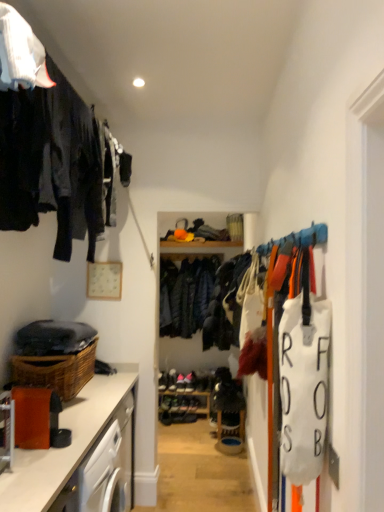
What is the approximate width of leather shoe at center, placed as the first shoe when sorted from bottom to top?

It is 7.48 inches.

The image size is (384, 512). In order to click on leather shoe at center, marked as the fourth shoe in a bottom-to-top arrangement in this screenshot , I will do `click(172, 379)`.

In terms of size, does leather shoe at center, the 3th shoe when ordered from bottom to top, appear bigger or smaller than dark blue woolen jacket at center?

Clearly, leather shoe at center, the 3th shoe when ordered from bottom to top, is smaller in size than dark blue woolen jacket at center.

Visually, is leather shoe at center, the 2th shoe viewed from the top, positioned to the left or to the right of dark blue woolen jacket at center?

In the image, leather shoe at center, the 2th shoe viewed from the top, appears on the left side of dark blue woolen jacket at center.

Consider the image. Can you confirm if leather shoe at center, the 3th shoe when ordered from bottom to top, is wider than dark blue woolen jacket at center?

Incorrect, the width of leather shoe at center, the 3th shoe when ordered from bottom to top, does not surpass that of dark blue woolen jacket at center.

What's the angular difference between wooden shelf at center and dark blue woolen jacket at center's facing directions?

The facing directions of wooden shelf at center and dark blue woolen jacket at center are 1.59 degrees apart.

Who is taller, wooden shelf at center or dark blue woolen jacket at center?

Standing taller between the two is dark blue woolen jacket at center.

Would you say dark blue woolen jacket at center is part of wooden shelf at center's contents?

Actually, dark blue woolen jacket at center is outside wooden shelf at center.

Which of these two, wooden shelf at center or dark blue woolen jacket at center, is wider?

dark blue woolen jacket at center.

Is leather shoe at center, arranged as the 4th shoe when viewed from the top, oriented towards matte brown countertop at lower left?

Yes, leather shoe at center, arranged as the 4th shoe when viewed from the top, is oriented towards matte brown countertop at lower left.

From a real-world perspective, does leather shoe at center, arranged as the 4th shoe when viewed from the top, stand above matte brown countertop at lower left?

Actually, leather shoe at center, arranged as the 4th shoe when viewed from the top, is physically below matte brown countertop at lower left in the real world.

From the image's perspective, which is below, leather shoe at center, placed as the first shoe when sorted from bottom to top, or matte brown countertop at lower left?

leather shoe at center, placed as the first shoe when sorted from bottom to top.

In the scene shown: Who is smaller, leather shoe at center, arranged as the 4th shoe when viewed from the top, or matte brown countertop at lower left?

leather shoe at center, arranged as the 4th shoe when viewed from the top.

From the image's perspective, is dark blue woolen jacket at center positioned above or below shiny black shoe at center, placed as the 3th shoe when sorted from top to bottom?

dark blue woolen jacket at center is above shiny black shoe at center, placed as the 3th shoe when sorted from top to bottom.

Considering the sizes of objects dark blue woolen jacket at center and shiny black shoe at center, placed as the 3th shoe when sorted from top to bottom, in the image provided, who is bigger, dark blue woolen jacket at center or shiny black shoe at center, placed as the 3th shoe when sorted from top to bottom,?

dark blue woolen jacket at center is bigger.

Is dark blue woolen jacket at center taller or shorter than shiny black shoe at center, placed as the 3th shoe when sorted from top to bottom?

In the image, dark blue woolen jacket at center appears to be taller than shiny black shoe at center, placed as the 3th shoe when sorted from top to bottom.

Which object is positioned more to the left, dark blue woolen jacket at center or shiny black shoe at center, placed as the 3th shoe when sorted from top to bottom?

shiny black shoe at center, placed as the 3th shoe when sorted from top to bottom, is more to the left.

Are matte black clothing at left and woven brown basket at lower left beside each other?

No, matte black clothing at left is not beside woven brown basket at lower left.

Is matte black clothing at left at the left side of woven brown basket at lower left?

No, matte black clothing at left is not to the left of woven brown basket at lower left.

Identify the location of basket behind the matte black clothing at left. [x=56, y=371].

Is matte black clothing at left bigger than woven brown basket at lower left?

Yes.

Considering the sizes of leather shoe at center, the 2th shoe viewed from the top, and woven brown basket at lower left in the image, is leather shoe at center, the 2th shoe viewed from the top, wider or thinner than woven brown basket at lower left?

Clearly, leather shoe at center, the 2th shoe viewed from the top, has less width compared to woven brown basket at lower left.

Which object is closer to the camera taking this photo, leather shoe at center, the 3th shoe when ordered from bottom to top, or woven brown basket at lower left?

Positioned in front is woven brown basket at lower left.

Based on the photo, is leather shoe at center, the 2th shoe viewed from the top, with woven brown basket at lower left?

They are not placed beside each other.

From a real-world perspective, is leather shoe at center, the 2th shoe viewed from the top, on top of woven brown basket at lower left?

Incorrect, from a real-world perspective, leather shoe at center, the 2th shoe viewed from the top, is lower than woven brown basket at lower left.

From a real-world perspective, relative to dark blue woolen jacket at center, is woven brown basket at lower left vertically above or below?

woven brown basket at lower left is below dark blue woolen jacket at center.

Does woven brown basket at lower left turn towards dark blue woolen jacket at center?

No.

Considering the relative sizes of woven brown basket at lower left and dark blue woolen jacket at center in the image provided, is woven brown basket at lower left smaller than dark blue woolen jacket at center?

Indeed, woven brown basket at lower left has a smaller size compared to dark blue woolen jacket at center.

This screenshot has height=512, width=384. I want to click on clothing positioned vertically above the leather shoe at center, the 2th shoe viewed from the top (from a real-world perspective), so click(185, 295).

You are a GUI agent. You are given a task and a screenshot of the screen. Output one action in this format:
    pyautogui.click(x=<x>, y=<y>)
    Task: Click on the shelf below the dark blue woolen jacket at center (from a real-world perspective)
    
    Given the screenshot: What is the action you would take?
    pyautogui.click(x=184, y=403)

Looking at the image, which one is located closer to wooden shelf at center, dark blue woolen jacket at center or matte brown countertop at lower left?

The object closer to wooden shelf at center is dark blue woolen jacket at center.

Based on the photo, based on their spatial positions, is matte brown countertop at lower left or woven brown basket at lower left further from wooden shelf at center?

The object further to wooden shelf at center is matte brown countertop at lower left.

When comparing their distances from matte black clothing at left, does woven brown basket at lower left or dark blue woolen jacket at center seem further?

dark blue woolen jacket at center lies further to matte black clothing at left than the other object.

Considering their positions, is wooden shelf at center positioned further to matte black clothing at left than leather shoe at center, placed as the first shoe when sorted from bottom to top?

The object further to matte black clothing at left is leather shoe at center, placed as the first shoe when sorted from bottom to top.

Which object lies nearer to the anchor point matte black clothing at left, wooden shelf at center or woven brown basket at lower left?

woven brown basket at lower left is positioned closer to the anchor matte black clothing at left.

Looking at the image, which one is located closer to leather shoe at center, the 3th shoe when ordered from bottom to top, leather shoe at center, placed as the first shoe when sorted from bottom to top, or leather shoe at center, placed as the 1th shoe when sorted from top to bottom?

leather shoe at center, placed as the 1th shoe when sorted from top to bottom.

Looking at the image, which one is located further to matte brown countertop at lower left, wooden shelf at center or woven brown basket at lower left?

wooden shelf at center lies further to matte brown countertop at lower left than the other object.

Estimate the real-world distances between objects in this image. Which object is closer to dark blue woolen jacket at center, leather shoe at center, the 3th shoe when ordered from bottom to top, or matte black clothing at left?

leather shoe at center, the 3th shoe when ordered from bottom to top.

This screenshot has height=512, width=384. Identify the location of clothing located between matte brown countertop at lower left and leather shoe at center, placed as the first shoe when sorted from bottom to top, in the depth direction. (185, 295).

Where is `clothing located between matte brown countertop at lower left and leather shoe at center, the 2th shoe viewed from the top, in the depth direction`? This screenshot has width=384, height=512. clothing located between matte brown countertop at lower left and leather shoe at center, the 2th shoe viewed from the top, in the depth direction is located at coordinates (185, 295).

You are a GUI agent. You are given a task and a screenshot of the screen. Output one action in this format:
    pyautogui.click(x=<x>, y=<y>)
    Task: Click on the clothing between woven brown basket at lower left and wooden shelf at center in the front-back direction
    The width and height of the screenshot is (384, 512).
    Given the screenshot: What is the action you would take?
    pyautogui.click(x=185, y=295)

Where is `shelf between matte brown countertop at lower left and leather shoe at center, marked as the fourth shoe in a bottom-to-top arrangement, in the front-back direction`? shelf between matte brown countertop at lower left and leather shoe at center, marked as the fourth shoe in a bottom-to-top arrangement, in the front-back direction is located at coordinates (184, 403).